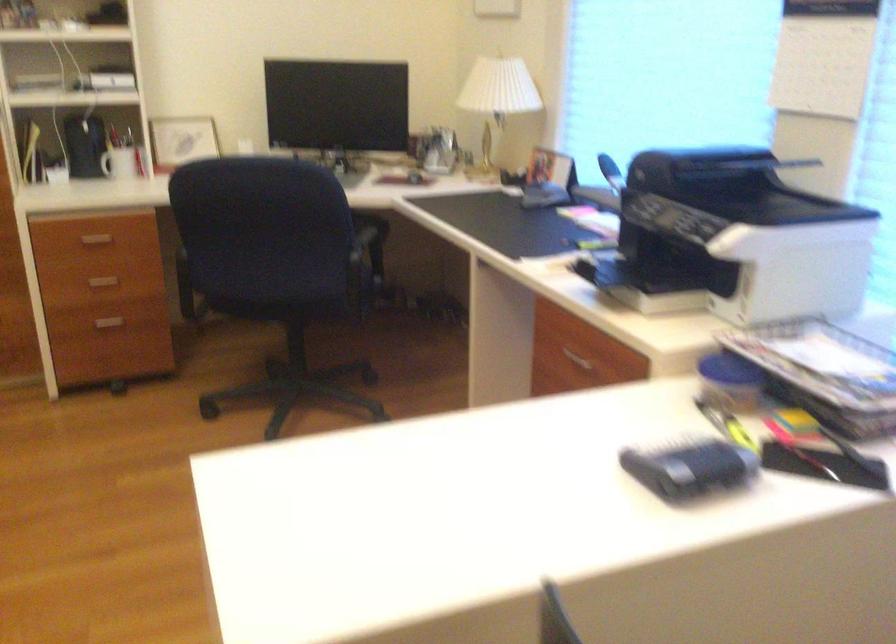
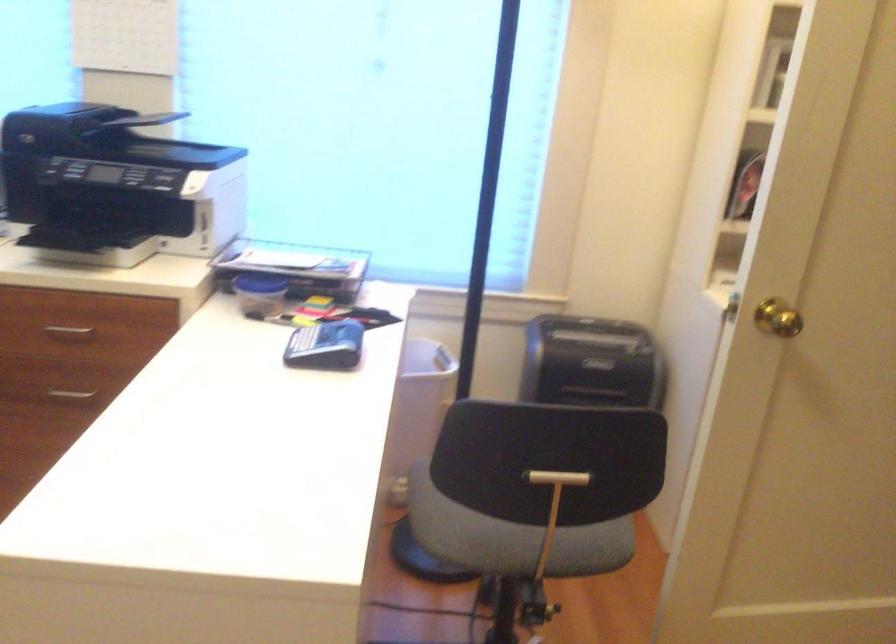
Find the pixel in the second image that matches pixel 693 464 in the first image.

(325, 346)